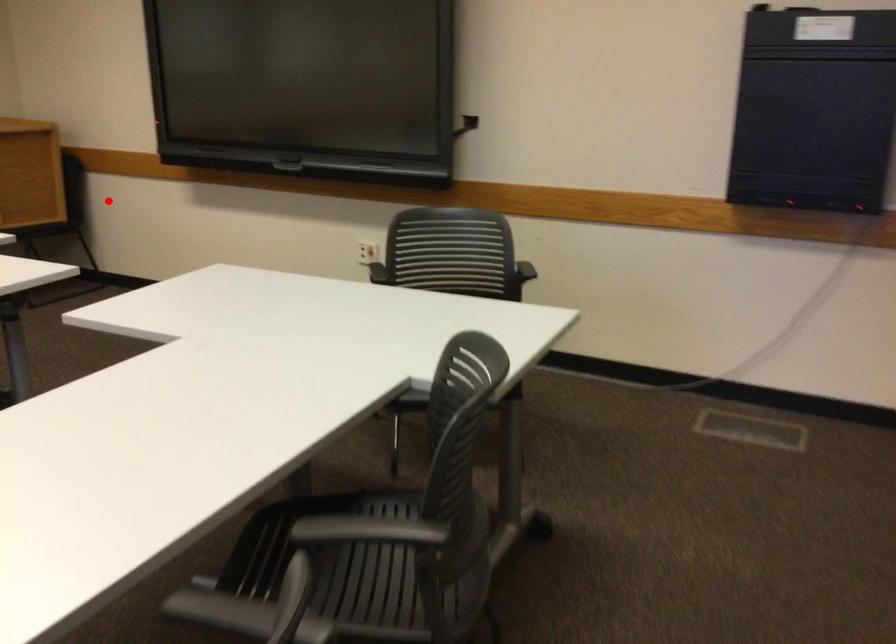
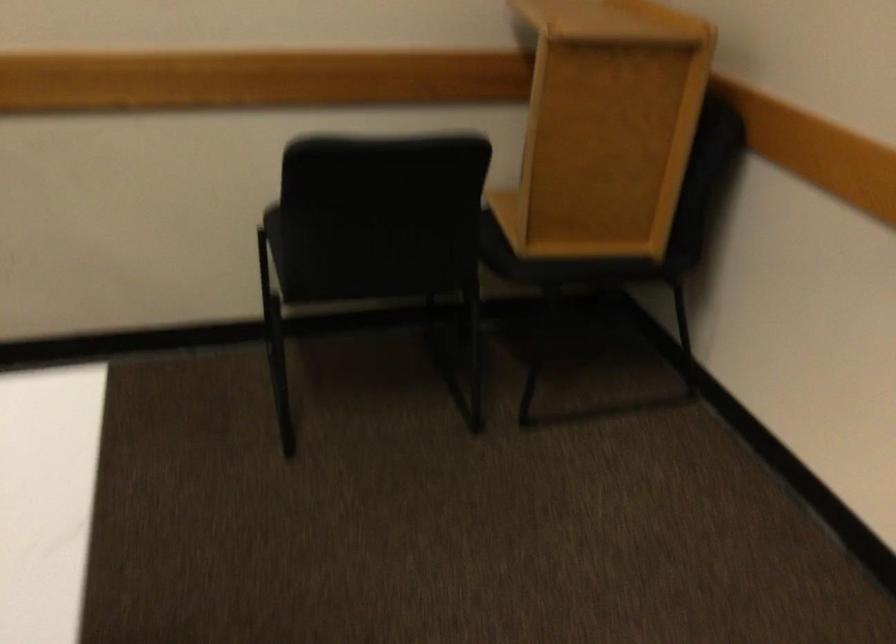
Question: I am providing you with two images of the same scene from different viewpoints. A red point is shown in image1. For the corresponding object point in image2, is it positioned nearer or farther from the camera?

Choices:
 (A) Nearer
 (B) Farther

Answer: (A)